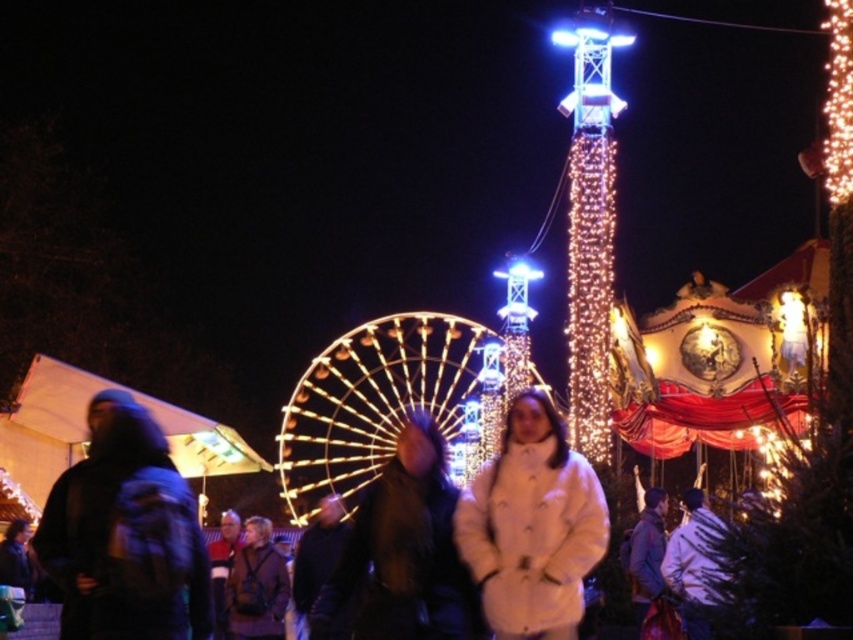
You are a photographer trying to capture the illuminated string lights at upper right without any people blocking them. Is the white fluffy coat at center in the way of the lights?

The white fluffy coat at center is in front of the illuminated string lights at upper right, so it is blocking the view of the lights.

You are at the fairground and want to locate the Ferris wheel. You notice two illuminated features in the upper part of the scene. Which one is the Ferris wheel? The Ferris wheel is the illuminated wireframe structure at upper center, which is positioned to the left of the illuminated string lights at upper right. However, according to the rules, the answer should not reveal the specific details from the Objects Description. Wait, let me adjust that. Hmm, the user wants the question to not include the info.

The Ferris wheel is the illuminated wireframe structure at upper center, which is positioned to the left of the illuminated string lights at upper right.

You are a photographer trying to capture the tallest object in the scene. Which object should you focus on between the illuminated wireframe structure at upper center and the illuminated string lights at upper right?

The illuminated wireframe structure at upper center is taller than the illuminated string lights at upper right, so you should focus on the illuminated wireframe structure at upper center to capture the tallest object.